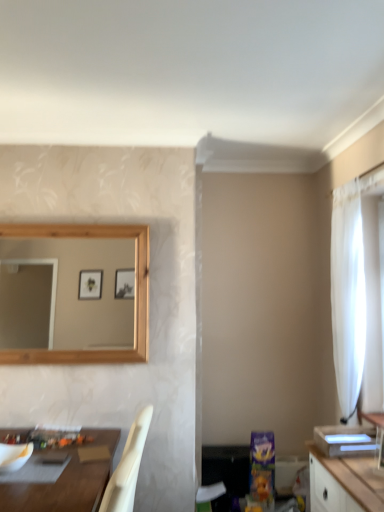
Find the location of a particular element. Image resolution: width=384 pixels, height=512 pixels. vacant space to the right of white matte mixing bowl at lower left is located at coordinates (49, 471).